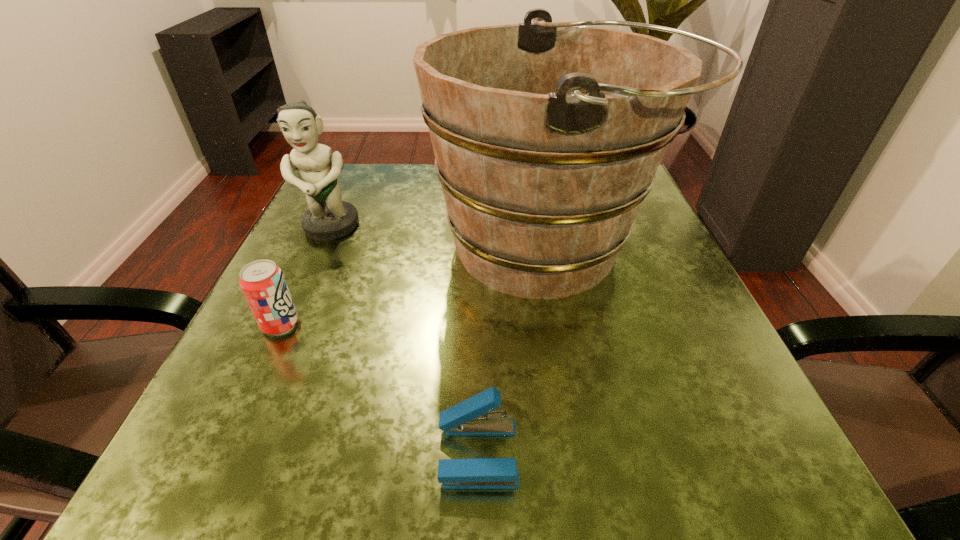
Where is `object at the near edge`? The width and height of the screenshot is (960, 540). object at the near edge is located at coordinates (472, 417).

Locate an element on the screen. This screenshot has height=540, width=960. figurine at the left edge is located at coordinates (328, 218).

Identify the location of soda can positioned at the left edge. (264, 286).

Image resolution: width=960 pixels, height=540 pixels. What are the coordinates of `object present at the right edge` in the screenshot? It's located at (547, 137).

What are the coordinates of `object present at the far left corner` in the screenshot? It's located at (328, 218).

Locate an element on the screen. The width and height of the screenshot is (960, 540). object that is positioned at the far right corner is located at coordinates (547, 137).

This screenshot has height=540, width=960. In the image, there is a desktop. In order to click on vacant space at the far edge in this screenshot , I will do `click(392, 182)`.

Locate an element on the screen. Image resolution: width=960 pixels, height=540 pixels. vacant region at the near edge of the desktop is located at coordinates (352, 465).

The image size is (960, 540). In the image, there is a desktop. In order to click on vacant space at the left edge in this screenshot , I will do `click(327, 244)`.

In the image, there is a desktop. At what (x,y) coordinates should I click in order to perform the action: click on vacant space at the right edge. Please return your answer as a coordinate pair (x, y). This screenshot has height=540, width=960. Looking at the image, I should click on (648, 320).